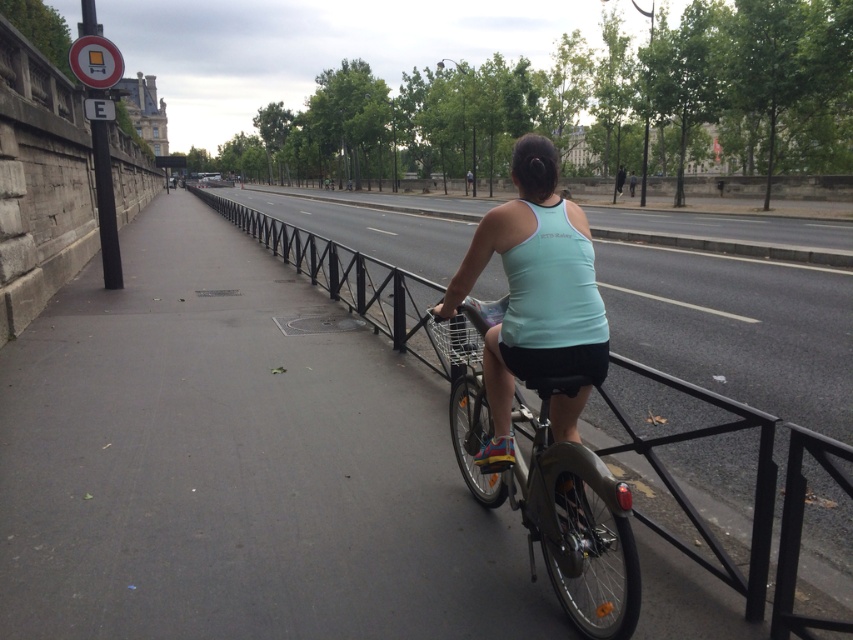
Looking at this image, can you confirm if black metal rail at center is bigger than light blue fabric tank top at center?

Yes, black metal rail at center is bigger than light blue fabric tank top at center.

Is black metal rail at center below light blue fabric tank top at center?

Actually, black metal rail at center is above light blue fabric tank top at center.

Does point (728, 573) come farther from viewer compared to point (502, 451)?

No, (728, 573) is in front of (502, 451).

Locate an element on the screen. The width and height of the screenshot is (853, 640). black metal rail at center is located at coordinates (363, 294).

Is black metal rail at center to the right of metallic silver bicycle at center from the viewer's perspective?

No, black metal rail at center is not to the right of metallic silver bicycle at center.

Which is above, black metal rail at center or metallic silver bicycle at center?

black metal rail at center

Which is behind, point (618, 404) or point (460, 444)?

The point (460, 444) is more distant.

Where is `black metal rail at center`? black metal rail at center is located at coordinates (363, 294).

How much distance is there between metallic silver bicycle at center and light blue fabric tank top at center?

A distance of 24.01 inches exists between metallic silver bicycle at center and light blue fabric tank top at center.

Can you confirm if metallic silver bicycle at center is positioned to the right of light blue fabric tank top at center?

Incorrect, metallic silver bicycle at center is not on the right side of light blue fabric tank top at center.

This screenshot has height=640, width=853. Identify the location of metallic silver bicycle at center. (546, 484).